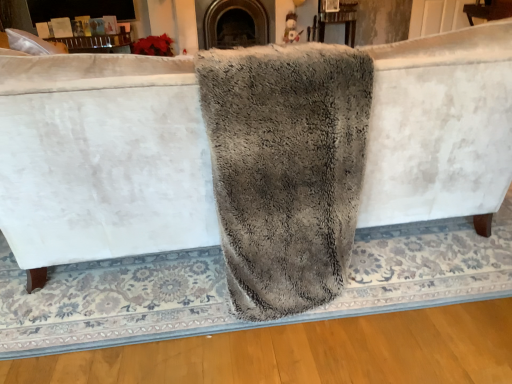
Question: Could you tell me if gray fluffy bath towel at center is turned towards wooden table at upper center?

Choices:
 (A) yes
 (B) no

Answer: (B)

Question: From a real-world perspective, is gray fluffy bath towel at center located beneath wooden table at upper center?

Choices:
 (A) yes
 (B) no

Answer: (B)

Question: Is the position of gray fluffy bath towel at center more distant than that of wooden table at upper center?

Choices:
 (A) yes
 (B) no

Answer: (B)

Question: Does gray fluffy bath towel at center have a lesser height compared to wooden table at upper center?

Choices:
 (A) no
 (B) yes

Answer: (A)

Question: Does gray fluffy bath towel at center have a smaller size compared to wooden table at upper center?

Choices:
 (A) yes
 (B) no

Answer: (B)

Question: From a real-world perspective, is gray fluffy bath towel at center above or below wooden table at upper center?

Choices:
 (A) below
 (B) above

Answer: (B)

Question: Does point (231, 117) appear closer or farther from the camera than point (349, 3)?

Choices:
 (A) closer
 (B) farther

Answer: (A)

Question: Would you say gray fluffy bath towel at center is to the left or to the right of wooden table at upper center in the picture?

Choices:
 (A) left
 (B) right

Answer: (A)

Question: Is gray fluffy bath towel at center taller or shorter than wooden table at upper center?

Choices:
 (A) tall
 (B) short

Answer: (A)

Question: Visually, is wooden table at upper center positioned to the left or to the right of dark gray stone fireplace at center?

Choices:
 (A) left
 (B) right

Answer: (B)

Question: From their relative heights in the image, would you say wooden table at upper center is taller or shorter than dark gray stone fireplace at center?

Choices:
 (A) tall
 (B) short

Answer: (B)

Question: Do you think wooden table at upper center is within dark gray stone fireplace at center, or outside of it?

Choices:
 (A) inside
 (B) outside

Answer: (B)

Question: Considering the positions of wooden table at upper center and dark gray stone fireplace at center in the image, is wooden table at upper center wider or thinner than dark gray stone fireplace at center?

Choices:
 (A) thin
 (B) wide

Answer: (A)

Question: In terms of width, does wooden table at upper center look wider or thinner when compared to gray fluffy bath towel at center?

Choices:
 (A) thin
 (B) wide

Answer: (A)

Question: Looking at the image, does wooden table at upper center seem bigger or smaller compared to gray fluffy bath towel at center?

Choices:
 (A) small
 (B) big

Answer: (A)